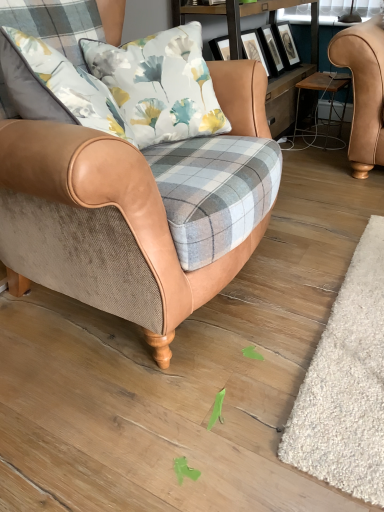
Locate an element on the screen. This screenshot has height=512, width=384. vacant area on top of white shaggy rug at lower right (from a real-world perspective) is located at coordinates (354, 347).